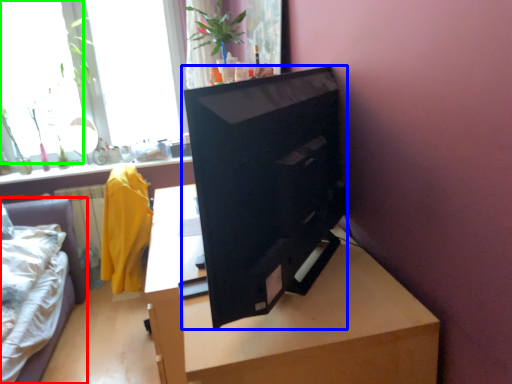
Question: Estimate the real-world distances between objects in this image. Which object is closer to furniture (highlighted by a red box), computer monitor (highlighted by a blue box) or window (highlighted by a green box)?

Choices:
 (A) computer monitor
 (B) window

Answer: (B)